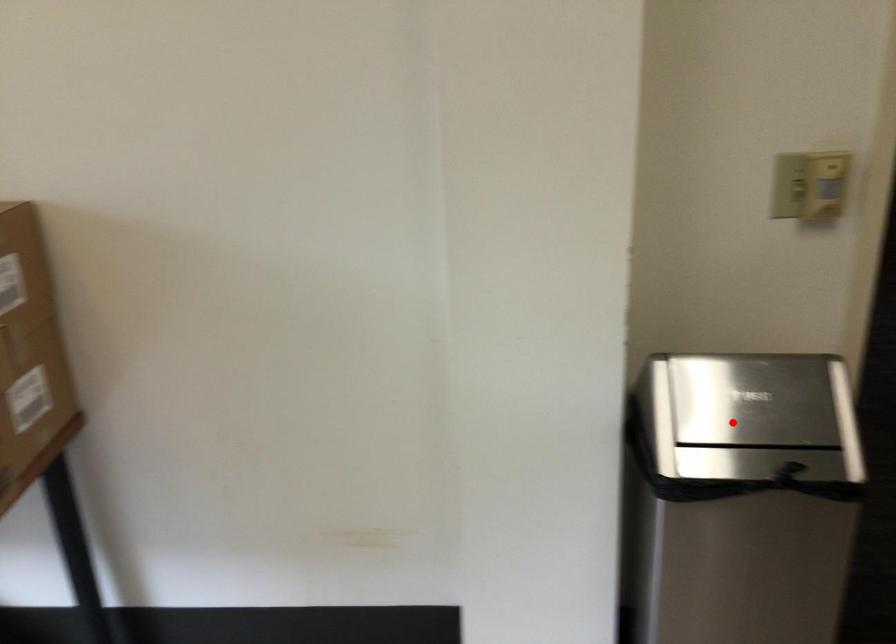
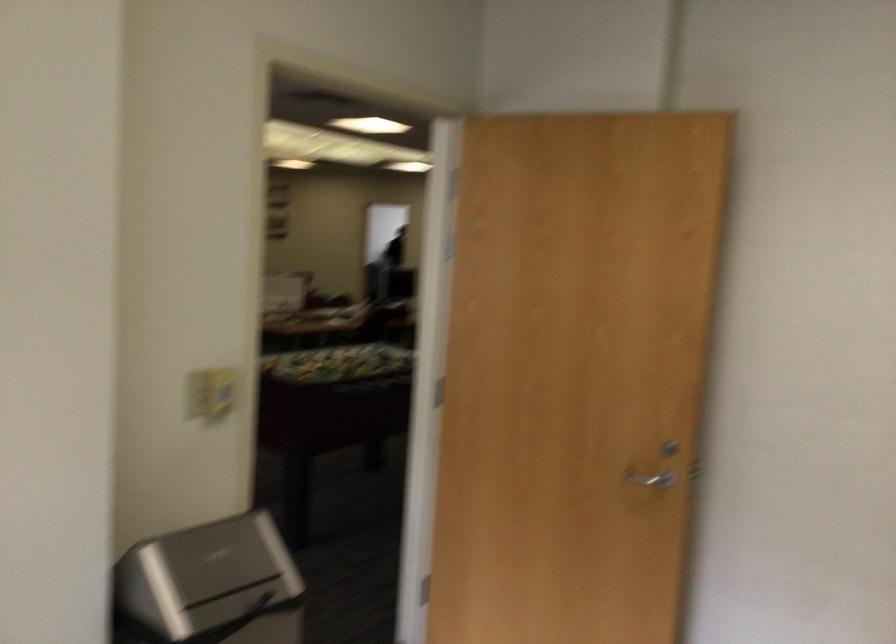
Question: I am providing you with two images of the same scene from different viewpoints. Given a red point in image1, look at the same physical point in image2. Is it:

Choices:
 (A) Closer to the viewpoint
 (B) Farther from the viewpoint

Answer: (B)